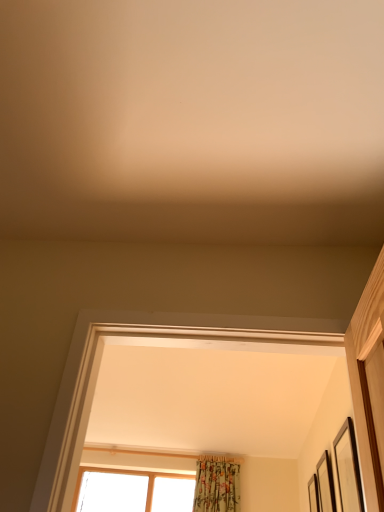
Question: Considering the relative sizes of wooden picture frame at right, the 3th picture frame viewed from the left, and black matte picture frame at right, the first picture frame when ordered from left to right, in the image provided, is wooden picture frame at right, the 3th picture frame viewed from the left, smaller than black matte picture frame at right, the first picture frame when ordered from left to right,?

Choices:
 (A) no
 (B) yes

Answer: (A)

Question: From a real-world perspective, is wooden picture frame at right, placed as the 1th picture frame when sorted from bottom to top, beneath black matte picture frame at right, which is counted as the third picture frame, starting from the back?

Choices:
 (A) yes
 (B) no

Answer: (B)

Question: Can you confirm if wooden picture frame at right, placed as the first picture frame when sorted from back to front, is taller than black matte picture frame at right, positioned as the 3th picture frame in bottom-to-top order?

Choices:
 (A) yes
 (B) no

Answer: (B)

Question: Can you confirm if wooden picture frame at right, placed as the 1th picture frame when sorted from bottom to top, is positioned to the left of black matte picture frame at right, the 3th picture frame in the right-to-left sequence?

Choices:
 (A) no
 (B) yes

Answer: (A)

Question: Does wooden picture frame at right, the 3th picture frame viewed from the left, have a lesser height compared to black matte picture frame at right, positioned as the 3th picture frame in bottom-to-top order?

Choices:
 (A) no
 (B) yes

Answer: (B)

Question: Is point (324, 472) closer or farther from the camera than point (314, 495)?

Choices:
 (A) closer
 (B) farther

Answer: (A)

Question: From a real-world perspective, is wooden picture frame at right, the second picture frame positioned from the bottom, above or below wooden picture frame at right, which ranks as the third picture frame in top-to-bottom order?

Choices:
 (A) above
 (B) below

Answer: (B)

Question: Looking at the image, does wooden picture frame at right, the 2th picture frame when ordered from front to back, seem bigger or smaller compared to wooden picture frame at right, the third picture frame when ordered from front to back?

Choices:
 (A) big
 (B) small

Answer: (B)

Question: Would you say wooden picture frame at right, acting as the second picture frame starting from the back, is inside or outside wooden picture frame at right, placed as the first picture frame when sorted from back to front?

Choices:
 (A) inside
 (B) outside

Answer: (B)

Question: From a real-world perspective, is wooden picture frame at right, the third picture frame when ordered from front to back, physically located above or below wooden picture frame at right, the 2th picture frame when ordered from front to back?

Choices:
 (A) above
 (B) below

Answer: (A)

Question: In terms of width, does wooden picture frame at right, placed as the first picture frame when sorted from back to front, look wider or thinner when compared to wooden picture frame at right, the second picture frame positioned from the bottom?

Choices:
 (A) thin
 (B) wide

Answer: (B)

Question: From the image's perspective, is wooden picture frame at right, the third picture frame when ordered from front to back, positioned above or below wooden picture frame at right, the second picture frame positioned from the bottom?

Choices:
 (A) above
 (B) below

Answer: (B)

Question: Is wooden picture frame at right, placed as the 1th picture frame when sorted from bottom to top, bigger or smaller than wooden picture frame at right, acting as the second picture frame starting from the back?

Choices:
 (A) small
 (B) big

Answer: (B)

Question: From their relative heights in the image, would you say wooden picture frame at right, acting as the second picture frame starting from the back, is taller or shorter than black matte picture frame at right, which appears as the first picture frame when viewed from the top?

Choices:
 (A) short
 (B) tall

Answer: (A)

Question: Considering their positions, is wooden picture frame at right, marked as the 2th picture frame in a right-to-left arrangement, located in front of or behind black matte picture frame at right, the first picture frame from the front?

Choices:
 (A) front
 (B) behind

Answer: (B)